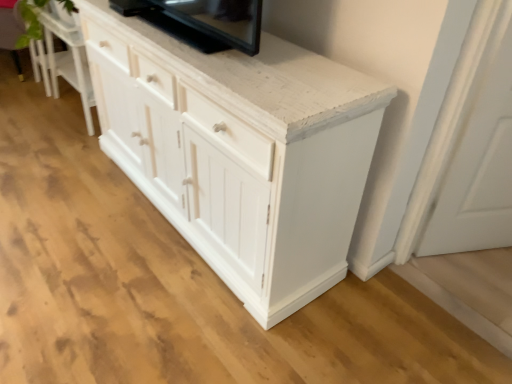
This screenshot has width=512, height=384. Find the location of `free location in front of white wood cabinet at lower left`. free location in front of white wood cabinet at lower left is located at coordinates (54, 147).